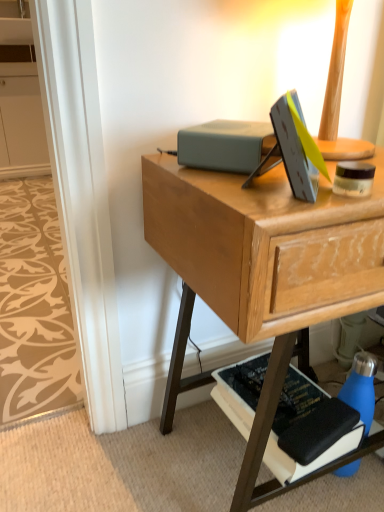
Question: In the image, is blue matte water bottle at lower right on the left side or the right side of matte gray book at center, which is counted as the first paperback book, starting from the top?

Choices:
 (A) left
 (B) right

Answer: (B)

Question: Based on their sizes in the image, would you say blue matte water bottle at lower right is bigger or smaller than matte gray book at center, positioned as the 2th paperback book in bottom-to-top order?

Choices:
 (A) big
 (B) small

Answer: (A)

Question: Estimate the real-world distances between objects in this image. Which object is closer to the matte gray book at center, positioned as the 2th paperback book in bottom-to-top order?

Choices:
 (A) wooden desk at center
 (B) black matte book at lower right, the second paperback book positioned from the top
 (C) blue matte water bottle at lower right
 (D) beige patterned carpet at lower left
 (E) white matte cabinet at upper left

Answer: (A)

Question: Which is nearer to the white matte cabinet at upper left?

Choices:
 (A) beige patterned carpet at lower left
 (B) black matte book at lower right, which is the first paperback book in bottom-to-top order
 (C) blue matte water bottle at lower right
 (D) matte gray book at center, which is counted as the first paperback book, starting from the top
 (E) wooden desk at center

Answer: (A)